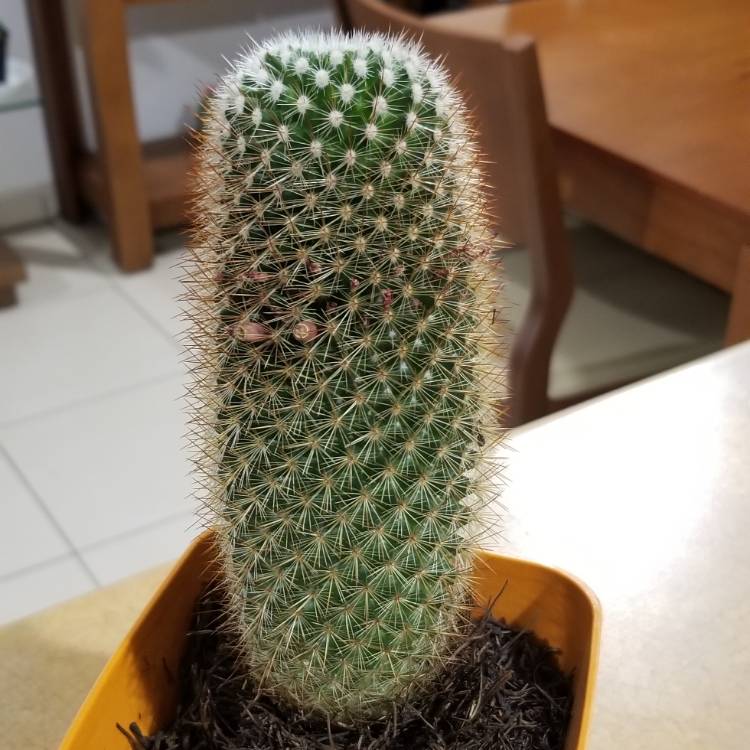
This screenshot has width=750, height=750. What are the coordinates of `seatback` in the screenshot? It's located at (478, 50).